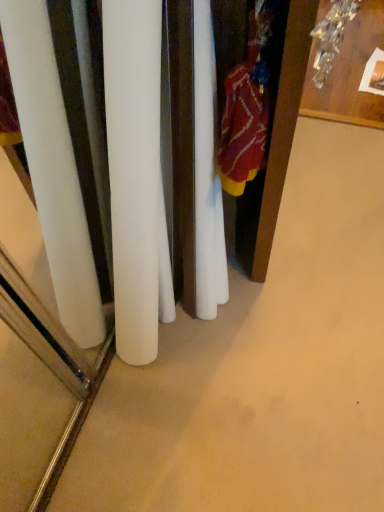
Question: From a real-world perspective, relative to wooden table at upper right, is wooden armoire at right vertically above or below?

Choices:
 (A) below
 (B) above

Answer: (B)

Question: Considering the positions of wooden armoire at right and wooden table at upper right in the image, is wooden armoire at right taller or shorter than wooden table at upper right?

Choices:
 (A) short
 (B) tall

Answer: (B)

Question: Which object is the farthest from the wooden table at upper right?

Choices:
 (A) knitted wool sweater at right
 (B) wooden armoire at right

Answer: (A)

Question: Based on their relative distances, which object is farther from the wooden table at upper right?

Choices:
 (A) knitted wool sweater at right
 (B) wooden armoire at right

Answer: (A)